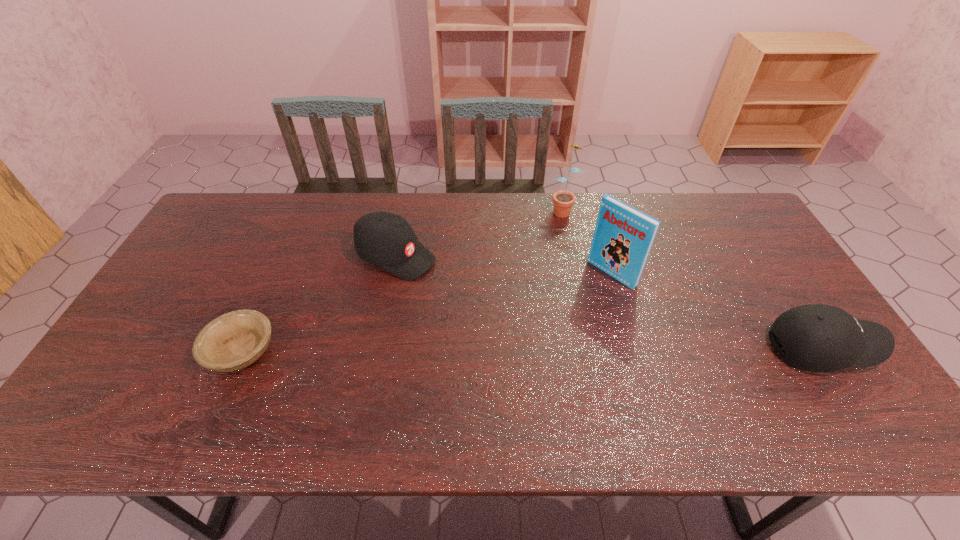
At what (x,y) coordinates should I click in order to perform the action: click on free spot between the sunflower and the leftmost object. Please return your answer as a coordinate pair (x, y). The height and width of the screenshot is (540, 960). Looking at the image, I should click on (402, 280).

Identify the location of empty space that is in between the book and the sunflower. This screenshot has height=540, width=960. (588, 241).

This screenshot has height=540, width=960. In order to click on vacant space in between the rightmost object and the book in this screenshot , I will do `click(717, 311)`.

At what (x,y) coordinates should I click in order to perform the action: click on vacant space that's between the right baseball cap and the shortest object. Please return your answer as a coordinate pair (x, y). Looking at the image, I should click on (532, 350).

The height and width of the screenshot is (540, 960). In order to click on free spot between the fourth object from right to left and the book in this screenshot , I will do `click(504, 265)`.

Image resolution: width=960 pixels, height=540 pixels. I want to click on vacant space in between the bowl and the farthest object, so click(x=402, y=280).

The height and width of the screenshot is (540, 960). Identify the location of empty location between the sunflower and the shortest object. (402, 280).

Locate an element on the screen. vacant region between the farther baseball cap and the rightmost object is located at coordinates (609, 302).

Identify the location of free space between the right baseball cap and the fourth object from right to left. This screenshot has width=960, height=540. (609, 302).

Identify the location of object that ranks as the closest to the leftmost object. (384, 239).